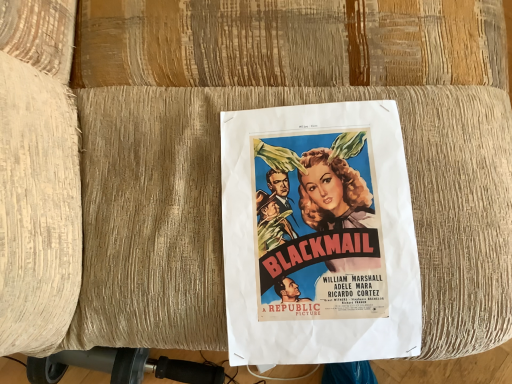
What do you see at coordinates (121, 366) in the screenshot? The image size is (512, 384). I see `black rubber vacuum at lower left` at bounding box center [121, 366].

I want to click on black rubber vacuum at lower left, so click(121, 366).

What is the approximate height of vintage paper poster at center?

10.62 centimeters.

What are the coordinates of `vintage paper poster at center` in the screenshot? It's located at (318, 235).

In order to face vintage paper poster at center, should I rotate leftwards or rightwards?

To face it directly, rotate right by 8.005 degrees.

This screenshot has height=384, width=512. What do you see at coordinates (318, 235) in the screenshot? I see `vintage paper poster at center` at bounding box center [318, 235].

This screenshot has width=512, height=384. Find the location of `black rubber vacuum at lower left`. black rubber vacuum at lower left is located at coordinates (121, 366).

Is black rubber vacuum at lower left to the left of vintage paper poster at center from the viewer's perspective?

Yes.

Considering their positions, is black rubber vacuum at lower left located in front of or behind vintage paper poster at center?

black rubber vacuum at lower left is behind vintage paper poster at center.

In the scene shown: Which point is more forward, (155, 371) or (246, 204)?

Point (246, 204)

From the image's perspective, which is below, black rubber vacuum at lower left or vintage paper poster at center?

From the image's view, black rubber vacuum at lower left is below.

From a real-world perspective, relative to vintage paper poster at center, is black rubber vacuum at lower left vertically above or below?

black rubber vacuum at lower left is situated lower than vintage paper poster at center in the real world.

Considering the sizes of objects black rubber vacuum at lower left and vintage paper poster at center in the image provided, who is thinner, black rubber vacuum at lower left or vintage paper poster at center?

vintage paper poster at center.

Does black rubber vacuum at lower left have a lesser height compared to vintage paper poster at center?

No, black rubber vacuum at lower left is not shorter than vintage paper poster at center.

Considering the relative sizes of black rubber vacuum at lower left and vintage paper poster at center in the image provided, is black rubber vacuum at lower left smaller than vintage paper poster at center?

Correct, black rubber vacuum at lower left occupies less space than vintage paper poster at center.

Does black rubber vacuum at lower left contain vintage paper poster at center?

No, vintage paper poster at center is located outside of black rubber vacuum at lower left.

Is black rubber vacuum at lower left far away from vintage paper poster at center?

No, black rubber vacuum at lower left is not far away from vintage paper poster at center.

Could you tell me if black rubber vacuum at lower left is turned towards vintage paper poster at center?

No.

Measure the distance between black rubber vacuum at lower left and vintage paper poster at center.

black rubber vacuum at lower left is 39.12 centimeters away from vintage paper poster at center.

The width and height of the screenshot is (512, 384). What are the coordinates of `vacuum directly beneath the vintage paper poster at center (from a real-world perspective)` in the screenshot? It's located at (121, 366).

Which object is positioned more to the right, vintage paper poster at center or black rubber vacuum at lower left?

vintage paper poster at center is more to the right.

Considering their positions, is vintage paper poster at center located in front of or behind black rubber vacuum at lower left?

vintage paper poster at center is in front of black rubber vacuum at lower left.

Considering the positions of points (264, 168) and (40, 366), is point (264, 168) farther from camera compared to point (40, 366)?

That is False.

From the image's perspective, is vintage paper poster at center under black rubber vacuum at lower left?

No, from the image's perspective, vintage paper poster at center is not below black rubber vacuum at lower left.

From a real-world perspective, is vintage paper poster at center positioned over black rubber vacuum at lower left based on gravity?

Indeed, from a real-world perspective, vintage paper poster at center stands above black rubber vacuum at lower left.

Which object is thinner, vintage paper poster at center or black rubber vacuum at lower left?

vintage paper poster at center.

Can you confirm if vintage paper poster at center is shorter than black rubber vacuum at lower left?

Yes.

In terms of size, does vintage paper poster at center appear bigger or smaller than black rubber vacuum at lower left?

Clearly, vintage paper poster at center is larger in size than black rubber vacuum at lower left.

Is vintage paper poster at center not within black rubber vacuum at lower left?

vintage paper poster at center lies outside black rubber vacuum at lower left's area.

Is vintage paper poster at center not close to black rubber vacuum at lower left?

vintage paper poster at center is near black rubber vacuum at lower left, not far away.

Is vintage paper poster at center facing towards black rubber vacuum at lower left?

No, vintage paper poster at center does not turn towards black rubber vacuum at lower left.

From the picture: How different are the orientations of vintage paper poster at center and black rubber vacuum at lower left in degrees?

They differ by 5.23 degrees in their facing directions.

The width and height of the screenshot is (512, 384). I want to click on poster above the black rubber vacuum at lower left (from the image's perspective), so click(x=318, y=235).

The width and height of the screenshot is (512, 384). In order to click on vacuum below the vintage paper poster at center (from the image's perspective) in this screenshot , I will do `click(121, 366)`.

This screenshot has height=384, width=512. I want to click on poster that appears on the right of black rubber vacuum at lower left, so click(318, 235).